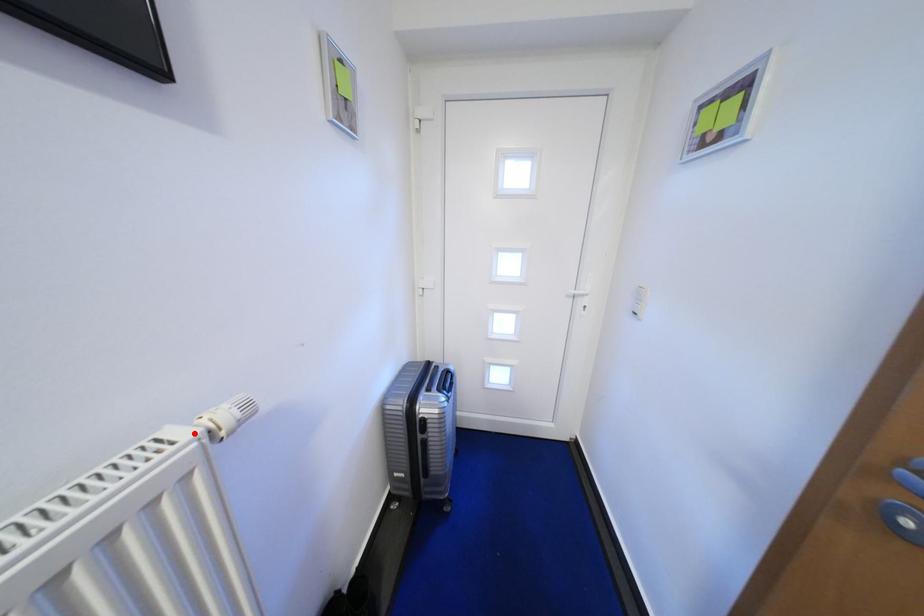
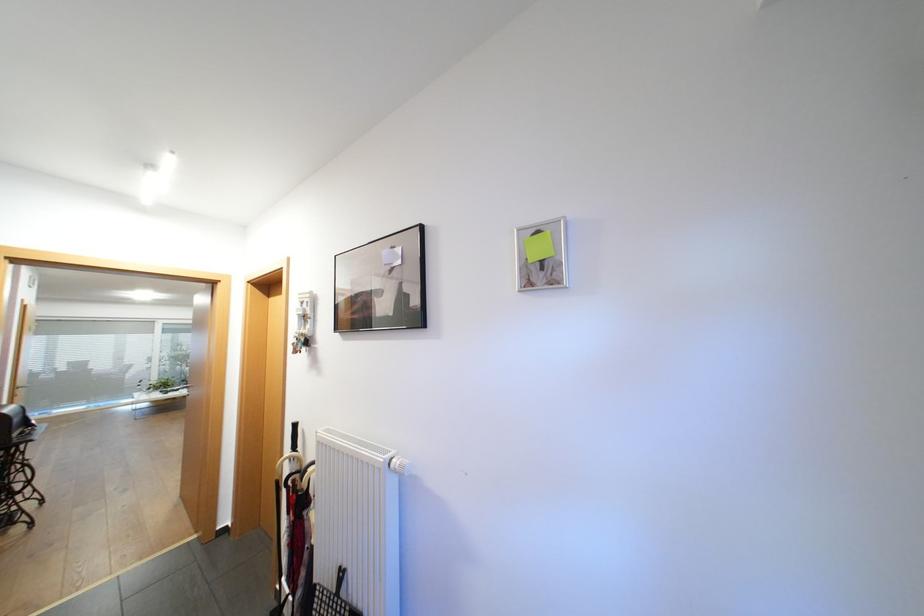
The point at the highlighted location is marked in the first image. Where is the corresponding point in the second image?

(394, 456)